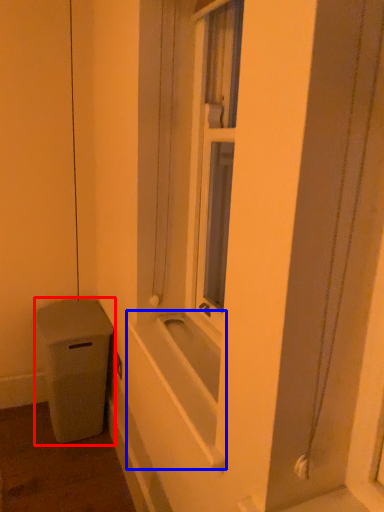
Question: Among these objects, which one is nearest to the camera, waste container (highlighted by a red box) or bath (highlighted by a blue box)?

Choices:
 (A) waste container
 (B) bath

Answer: (B)